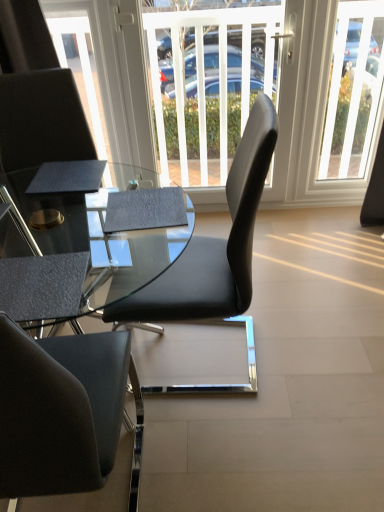
Identify the location of vacant area that lies to the right of black leather chair at center, the 1th chair viewed from the right. The height and width of the screenshot is (512, 384). (306, 352).